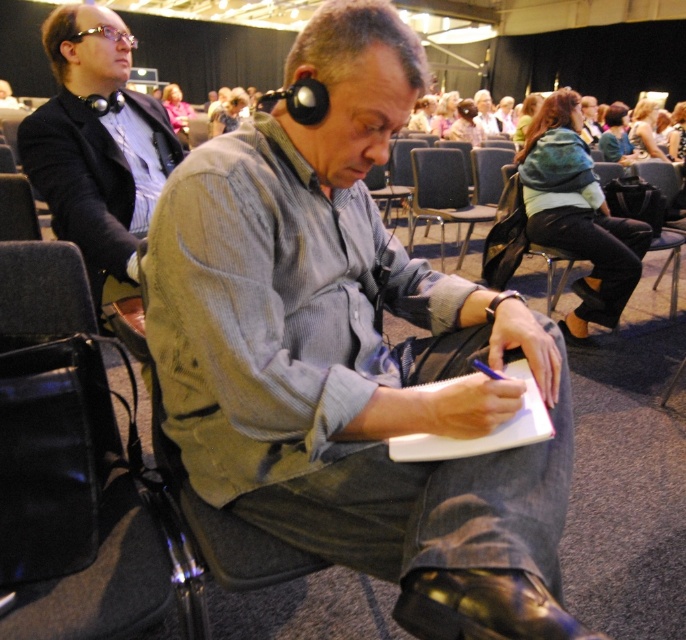
You are organizing a conference and need to ensure that the matte gray shirt at center and the black leather bag at lower left can fit on a shelf that is 1.2 meters wide. Based on their sizes, will both items fit side by side?

The matte gray shirt at center is larger than the black leather bag at lower left. However, without specific measurements of their individual sizes, it is impossible to determine if they will fit on a 1.2 meter shelf together.

You are organizing a conference and need to place a 12 feet long banner between the black leather bag at lower left and the blue fabric chair at center. Is there enough space for the banner?

The distance between the black leather bag at lower left and the blue fabric chair at center is 10.33 feet, which is shorter than the 12 feet banner. Therefore, there is not enough space to place the banner between them.

You are sitting in the blue fabric chair at center and need to reach the black leather bag at lower left. Is the bag within easy reach from your current position?

The black leather bag at lower left is closer to the viewer than the blue fabric chair at center, so it is likely within easy reach.